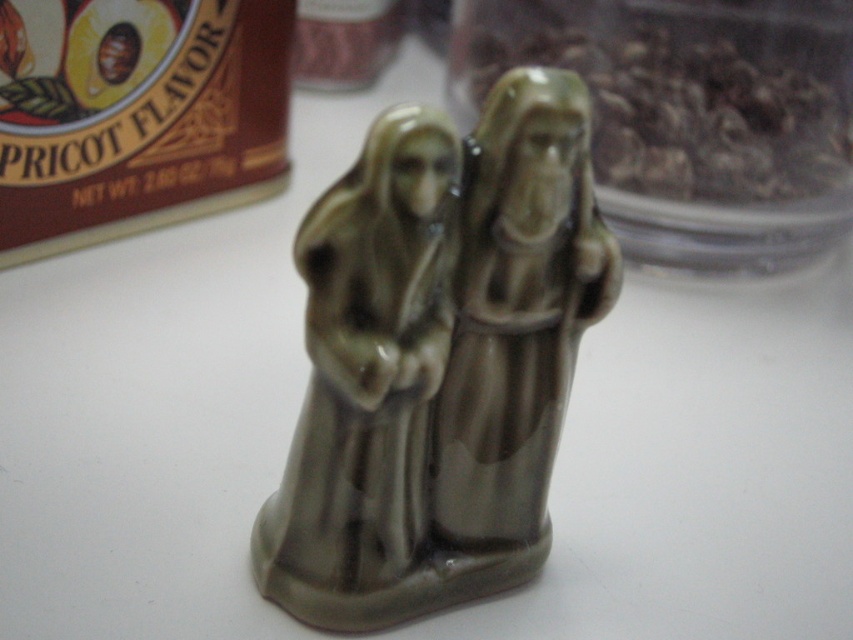
You are a customer in a store looking at the matte ceramic figures at center and the translucent plastic jar at upper right. Which item is nearer to you?

The matte ceramic figures at center are closer to the viewer than the translucent plastic jar at upper right.